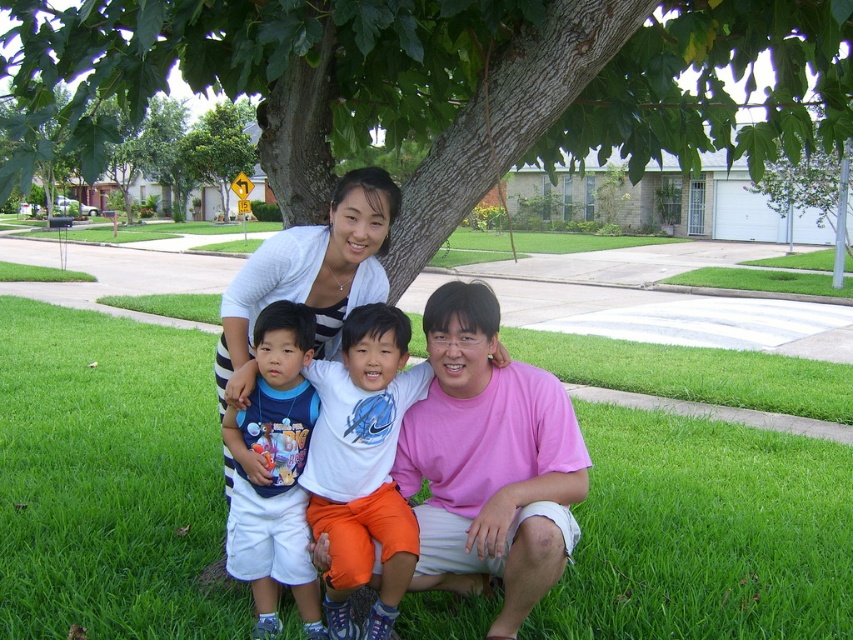
You are standing at the origin point in the image and want to walk to the point labeled point (x=270, y=305). However, there is an obstacle at point (x=357, y=230). Will you be able to see the target point without moving around the obstacle?

Since point (x=270, y=305) is behind point (x=357, y=230) from your perspective, you will not be able to see the target point without moving around the obstacle at point (x=357, y=230).

You are a drone operator trying to capture a photo of the family under the tree. The drone is currently hovering at point coordinates of 0.5, 0.5. To avoid capturing the green grass at lower center in the foreground, which is located at 0.748, 0.127, should you move the drone upwards or downwards?

Since the green grass at lower center is located at coordinates (107, 477), which is to the right and lower than the drone at (426, 320), moving the drone upwards would reduce the visibility of the green grass at lower center in the foreground.